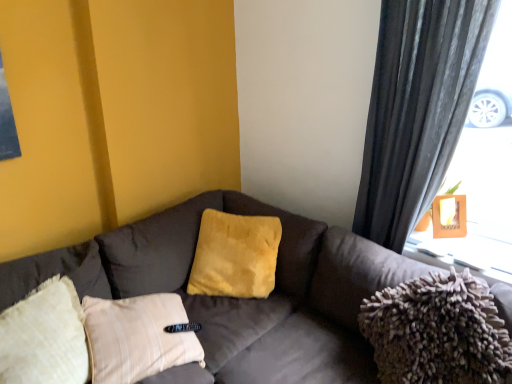
Question: Does yellow plush pillow at center have a larger size compared to wooden frame at upper right?

Choices:
 (A) yes
 (B) no

Answer: (A)

Question: Does yellow plush pillow at center have a lesser height compared to wooden frame at upper right?

Choices:
 (A) yes
 (B) no

Answer: (B)

Question: Does yellow plush pillow at center have a smaller size compared to wooden frame at upper right?

Choices:
 (A) yes
 (B) no

Answer: (B)

Question: Could you tell me if yellow plush pillow at center is turned towards wooden frame at upper right?

Choices:
 (A) no
 (B) yes

Answer: (A)

Question: Is yellow plush pillow at center at the right side of wooden frame at upper right?

Choices:
 (A) yes
 (B) no

Answer: (B)

Question: Is wooden frame at upper right in front of or behind dark gray textured curtain at right in the image?

Choices:
 (A) behind
 (B) front

Answer: (A)

Question: Considering the positions of wooden frame at upper right and dark gray textured curtain at right in the image, is wooden frame at upper right wider or thinner than dark gray textured curtain at right?

Choices:
 (A) thin
 (B) wide

Answer: (B)

Question: Looking at the image, does wooden frame at upper right seem bigger or smaller compared to dark gray textured curtain at right?

Choices:
 (A) small
 (B) big

Answer: (A)

Question: From the image's perspective, is wooden frame at upper right above or below dark gray textured curtain at right?

Choices:
 (A) above
 (B) below

Answer: (B)

Question: From the image's perspective, relative to wooden frame at upper right, is fuzzy fabric pillow at right above or below?

Choices:
 (A) below
 (B) above

Answer: (A)

Question: Is point (464, 345) positioned closer to the camera than point (477, 274)?

Choices:
 (A) closer
 (B) farther

Answer: (A)

Question: Considering the positions of fuzzy fabric pillow at right and wooden frame at upper right in the image, is fuzzy fabric pillow at right taller or shorter than wooden frame at upper right?

Choices:
 (A) tall
 (B) short

Answer: (A)

Question: Is fuzzy fabric pillow at right to the left or to the right of wooden frame at upper right in the image?

Choices:
 (A) left
 (B) right

Answer: (A)

Question: Is yellow plush pillow at center spatially inside dark gray textured curtain at right, or outside of it?

Choices:
 (A) inside
 (B) outside

Answer: (B)

Question: Considering the positions of yellow plush pillow at center and dark gray textured curtain at right in the image, is yellow plush pillow at center wider or thinner than dark gray textured curtain at right?

Choices:
 (A) thin
 (B) wide

Answer: (B)